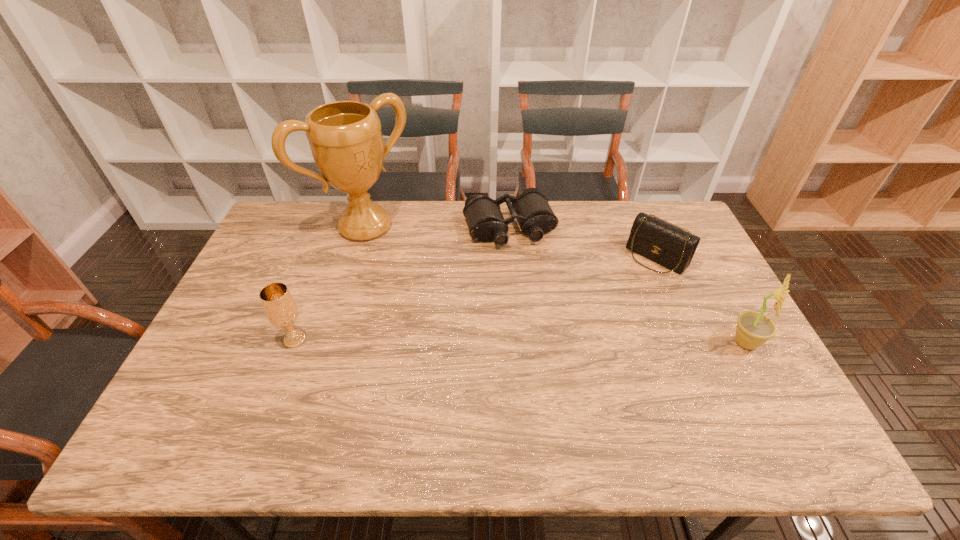
Locate an element on the screen. Image resolution: width=960 pixels, height=540 pixels. vacant space at the far left corner of the desktop is located at coordinates (291, 210).

You are a GUI agent. You are given a task and a screenshot of the screen. Output one action in this format:
    pyautogui.click(x=<x>, y=<y>)
    Task: Click on the vacant space at the far right corner
    
    Given the screenshot: What is the action you would take?
    pyautogui.click(x=653, y=205)

Locate an element on the screen. free area in between the third shortest object and the sunflower is located at coordinates (520, 342).

You are a GUI agent. You are given a task and a screenshot of the screen. Output one action in this format:
    pyautogui.click(x=<x>, y=<y>)
    Task: Click on the free space between the sunflower and the chalice
    Image resolution: width=960 pixels, height=540 pixels.
    Given the screenshot: What is the action you would take?
    pyautogui.click(x=520, y=342)

Identify the location of empty space that is in between the award and the second shortest object. (511, 242).

Where is `free space that is in between the third object from right to left and the award`? free space that is in between the third object from right to left and the award is located at coordinates (437, 227).

Locate an element on the screen. This screenshot has height=540, width=960. vacant space that is in between the third shortest object and the fourth shortest object is located at coordinates (520, 342).

You are a GUI agent. You are given a task and a screenshot of the screen. Output one action in this format:
    pyautogui.click(x=<x>, y=<y>)
    Task: Click on the vacant space that is in between the third shortest object and the tallest object
    The height and width of the screenshot is (540, 960).
    Given the screenshot: What is the action you would take?
    pyautogui.click(x=330, y=283)

Image resolution: width=960 pixels, height=540 pixels. In order to click on free point between the clutch bag and the tallest object in this screenshot , I will do `click(511, 242)`.

At what (x,y) coordinates should I click in order to perform the action: click on empty space between the shortest object and the award. Please return your answer as a coordinate pair (x, y). Looking at the image, I should click on pyautogui.click(x=437, y=227).